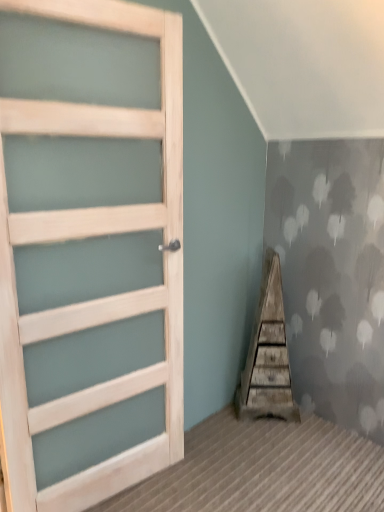
This screenshot has height=512, width=384. In order to click on empty space that is in between light wood door at left and weathered wood stairwell at center in this screenshot , I will do `click(224, 442)`.